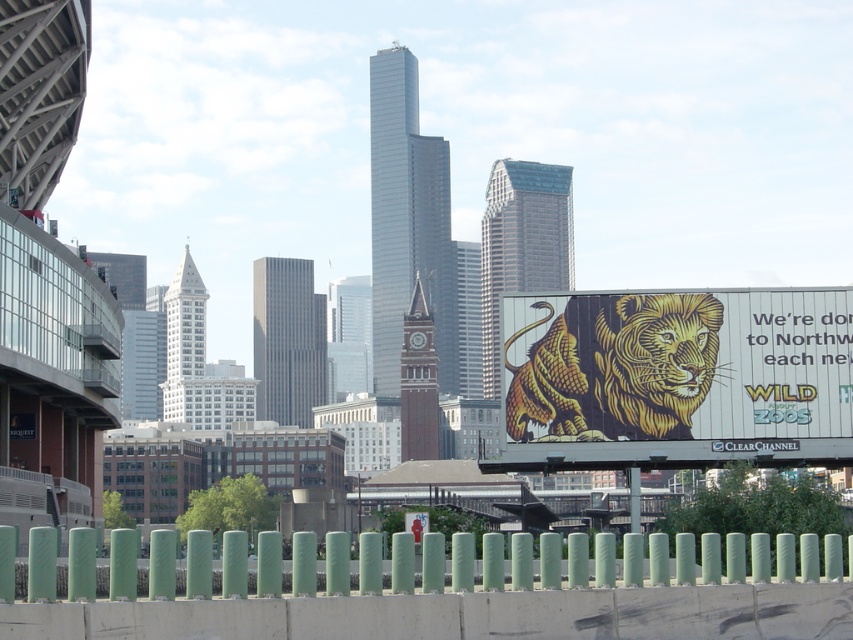
Question: Can you confirm if gold textured lion at right is smaller than green matte fence at lower center?

Choices:
 (A) yes
 (B) no

Answer: (A)

Question: Is gold textured lion at right wider than green matte fence at lower center?

Choices:
 (A) no
 (B) yes

Answer: (A)

Question: Does gold textured lion at right have a larger size compared to green matte fence at lower center?

Choices:
 (A) yes
 (B) no

Answer: (B)

Question: Which point appears farthest from the camera in this image?

Choices:
 (A) (192, 576)
 (B) (589, 316)

Answer: (B)

Question: Which point is closer to the camera?

Choices:
 (A) (646, 371)
 (B) (68, 588)

Answer: (B)